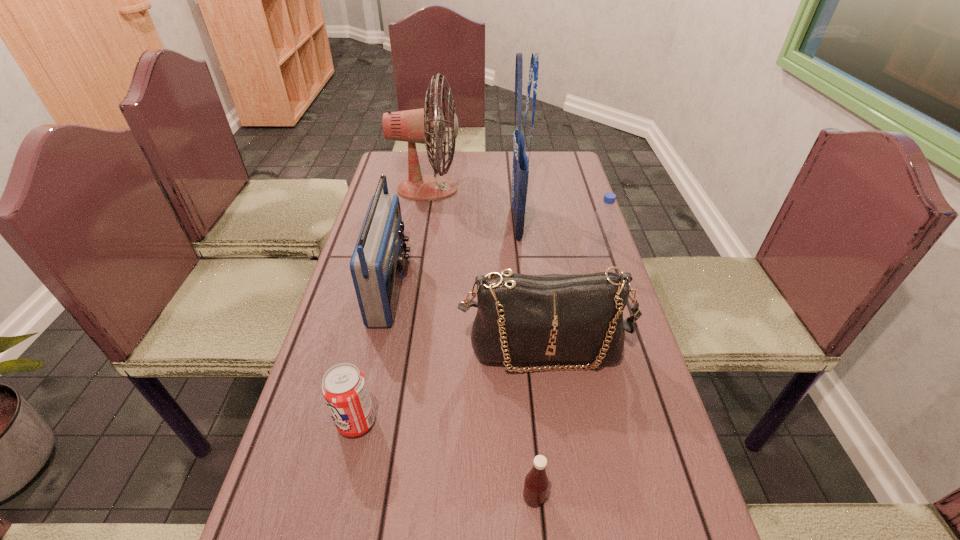
The height and width of the screenshot is (540, 960). In order to click on vacant area in the image that satisfies the following two spatial constraints: 1. on the front side of the sixth farthest object; 2. on the right side of the nearest object in this screenshot , I will do `click(339, 497)`.

In order to click on blank space that satisfies the following two spatial constraints: 1. on the front panel of the radio receiver; 2. on the left side of the nearest object in this screenshot , I will do `click(345, 497)`.

The image size is (960, 540). Find the location of `free region that satisfies the following two spatial constraints: 1. in front of the nearest object to direct airflow; 2. on the right side of the fan`. free region that satisfies the following two spatial constraints: 1. in front of the nearest object to direct airflow; 2. on the right side of the fan is located at coordinates (375, 497).